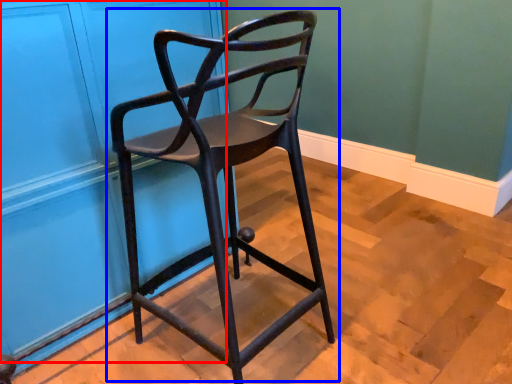
Question: Among these objects, which one is nearest to the camera, door (highlighted by a red box) or chair (highlighted by a blue box)?

Choices:
 (A) door
 (B) chair

Answer: (B)